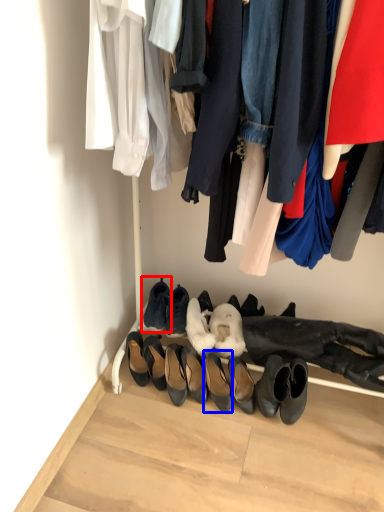
Question: Which point is further to the camera, footwear (highlighted by a red box) or footwear (highlighted by a blue box)?

Choices:
 (A) footwear
 (B) footwear

Answer: (A)